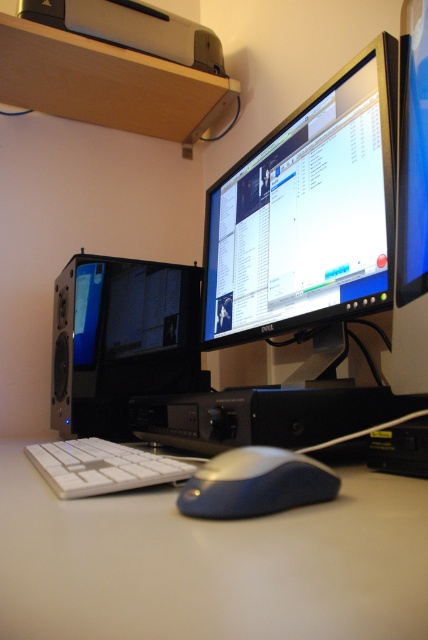
Question: In this image, where is transparent glass computer case at left located relative to satin blue mouse at center?

Choices:
 (A) right
 (B) left

Answer: (B)

Question: From the image, what is the correct spatial relationship of white plastic table at lower center in relation to white matte keyboard at lower center?

Choices:
 (A) below
 (B) above

Answer: (B)

Question: Which point appears closest to the camera in this image?

Choices:
 (A) (74, 282)
 (B) (183, 477)
 (C) (216, 184)

Answer: (B)

Question: Does satin blue mouse at center lie in front of white matte keyboard at lower center?

Choices:
 (A) yes
 (B) no

Answer: (A)

Question: Which object is farther from the camera taking this photo?

Choices:
 (A) satin blue mouse at center
 (B) white matte keyboard at lower center

Answer: (B)

Question: Which point is farther to the camera?

Choices:
 (A) white plastic table at lower center
 (B) black glossy monitor at center
 (C) transparent glass computer case at left

Answer: (C)